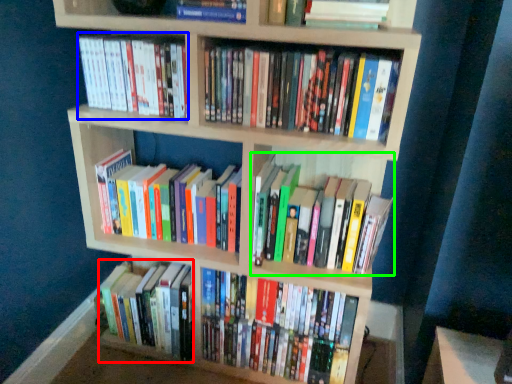
Question: Which object is the closest to the book (highlighted by a red box)? Choose among these: book (highlighted by a blue box) or book (highlighted by a green box).

Choices:
 (A) book
 (B) book

Answer: (B)